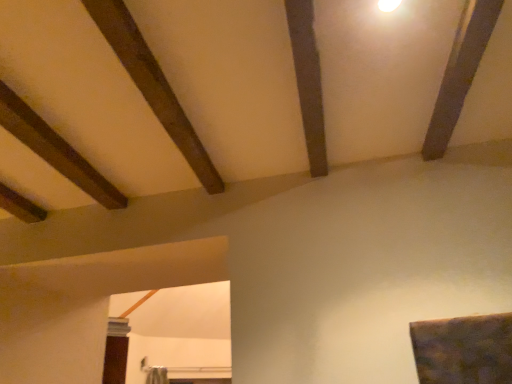
Question: Considering the relative sizes of dark brown wood at upper left, which is the first plank in left-to-right order, and dark brown wood plank at upper center, positioned as the 2th plank in left-to-right order, in the image provided, is dark brown wood at upper left, which is the first plank in left-to-right order, smaller than dark brown wood plank at upper center, positioned as the 2th plank in left-to-right order,?

Choices:
 (A) no
 (B) yes

Answer: (A)

Question: Is dark brown wood at upper left, the second plank viewed from the right, shorter than dark brown wood plank at upper center, which is counted as the first plank, starting from the right?

Choices:
 (A) no
 (B) yes

Answer: (A)

Question: Would you say dark brown wood at upper left, which is the first plank in left-to-right order, is a long distance from dark brown wood plank at upper center, which is counted as the first plank, starting from the right?

Choices:
 (A) yes
 (B) no

Answer: (B)

Question: Does dark brown wood at upper left, the second plank viewed from the right, turn towards dark brown wood plank at upper center, positioned as the 2th plank in left-to-right order?

Choices:
 (A) no
 (B) yes

Answer: (B)

Question: Is dark brown wood at upper left, the second plank viewed from the right, to the right of dark brown wood plank at upper center, which is counted as the first plank, starting from the right, from the viewer's perspective?

Choices:
 (A) no
 (B) yes

Answer: (A)

Question: From a real-world perspective, is dark brown wood at upper left, the second plank viewed from the right, on dark brown wood plank at upper center, which is counted as the first plank, starting from the right?

Choices:
 (A) yes
 (B) no

Answer: (A)

Question: Can we say dark brown wood plank at upper center, which is counted as the first plank, starting from the right, lies outside dark brown wood at upper left, which is the first plank in left-to-right order?

Choices:
 (A) no
 (B) yes

Answer: (B)

Question: Is dark brown wood plank at upper center, which is counted as the first plank, starting from the right, taller than dark brown wood at upper left, the second plank viewed from the right?

Choices:
 (A) no
 (B) yes

Answer: (A)

Question: Is dark brown wood plank at upper center, positioned as the 2th plank in left-to-right order, bigger than dark brown wood at upper left, the second plank viewed from the right?

Choices:
 (A) yes
 (B) no

Answer: (B)

Question: From the image's perspective, is dark brown wood plank at upper center, positioned as the 2th plank in left-to-right order, on dark brown wood at upper left, the second plank viewed from the right?

Choices:
 (A) no
 (B) yes

Answer: (B)

Question: Is dark brown wood plank at upper center, which is counted as the first plank, starting from the right, positioned in front of dark brown wood at upper left, the second plank viewed from the right?

Choices:
 (A) yes
 (B) no

Answer: (B)

Question: Is dark brown wood plank at upper center, positioned as the 2th plank in left-to-right order, oriented away from dark brown wood at upper left, which is the first plank in left-to-right order?

Choices:
 (A) yes
 (B) no

Answer: (A)

Question: From a real-world perspective, is dark brown wood at upper left, the second plank viewed from the right, physically located above or below dark brown wood plank at upper center, which is counted as the first plank, starting from the right?

Choices:
 (A) below
 (B) above

Answer: (B)